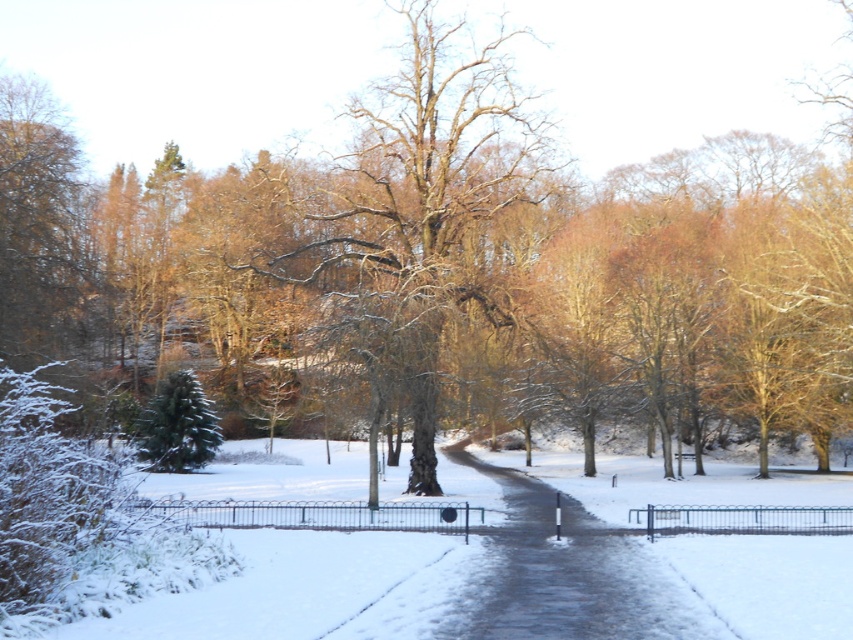
Who is higher up, bare wood tree at center or slick asphalt path at center?

bare wood tree at center is higher up.

Can you confirm if bare wood tree at center is shorter than slick asphalt path at center?

No.

The height and width of the screenshot is (640, 853). In order to click on bare wood tree at center in this screenshot , I will do `click(421, 212)`.

Find the location of a particular element. bare wood tree at center is located at coordinates (421, 212).